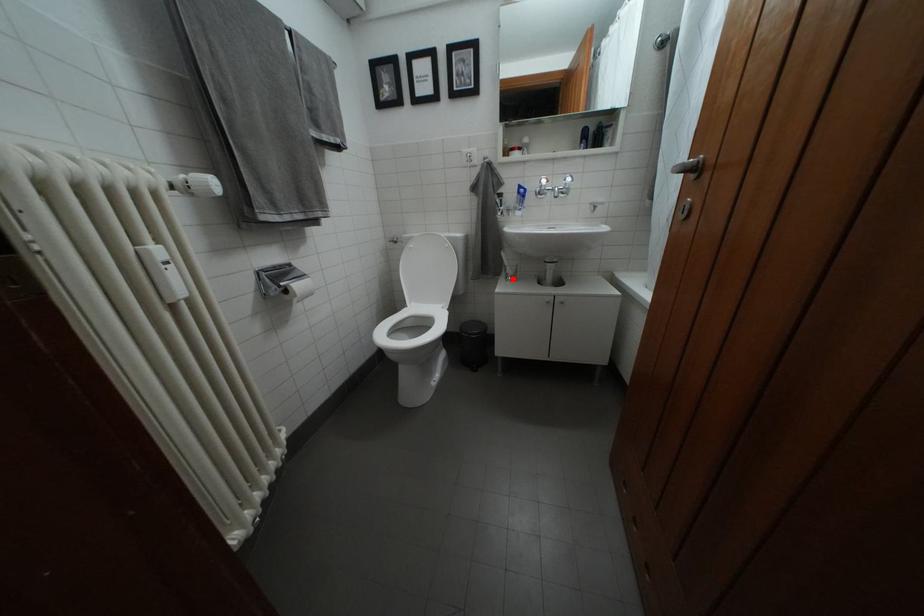
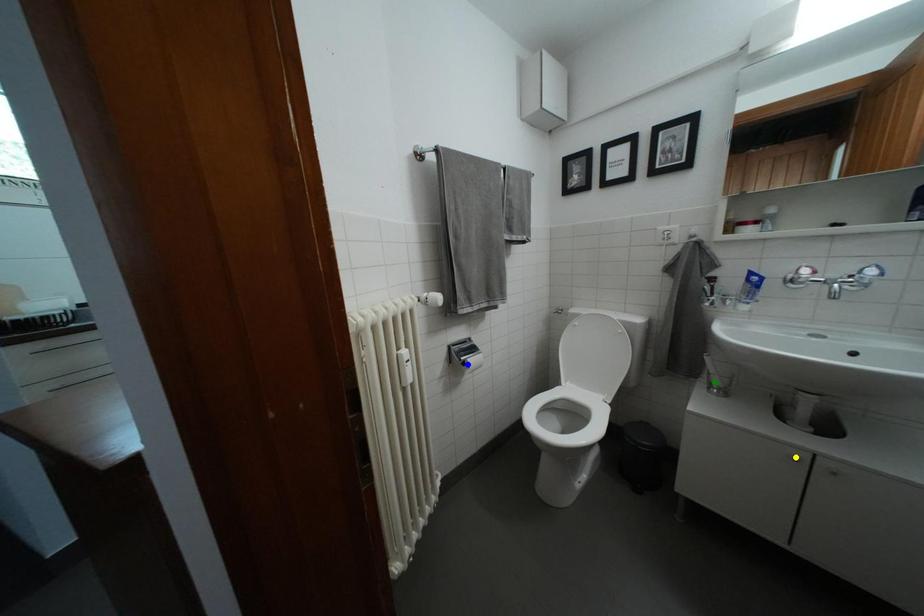
Question: I am providing you with two images of the same scene from different viewpoints. A red point is marked on the first image. You are given multiple points on the second image. Which point in image 2 represents the same 3d spot as the red point in image 1?

Choices:
 (A) blue point
 (B) yellow point
 (C) green point

Answer: (C)